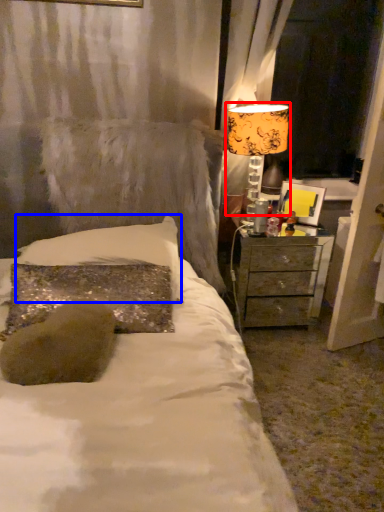
Question: Which object appears closest to the camera in this image, table lamp (highlighted by a red box) or pillow (highlighted by a blue box)?

Choices:
 (A) table lamp
 (B) pillow

Answer: (B)